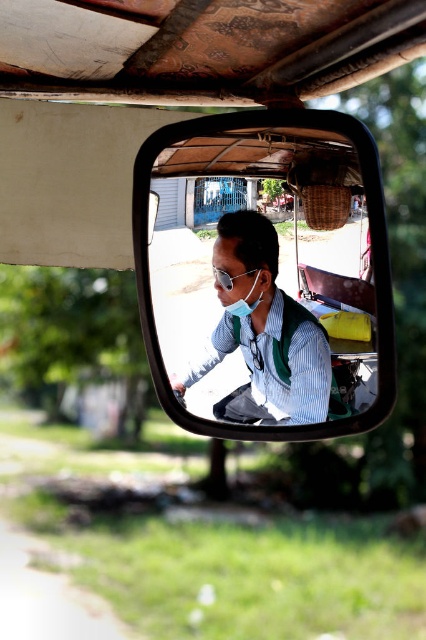
Question: Is clear plastic mirror at center closer to camera compared to matte black shirt at center?

Choices:
 (A) yes
 (B) no

Answer: (A)

Question: Which object appears farthest from the camera in this image?

Choices:
 (A) clear plastic mirror at center
 (B) matte black shirt at center
 (C) sunglasses at center

Answer: (C)

Question: Which object appears farthest from the camera in this image?

Choices:
 (A) matte black shirt at center
 (B) clear plastic mirror at center
 (C) sunglasses at center

Answer: (C)

Question: Which is farther from the sunglasses at center?

Choices:
 (A) matte black shirt at center
 (B) clear plastic mirror at center

Answer: (B)

Question: Is clear plastic mirror at center wider than sunglasses at center?

Choices:
 (A) no
 (B) yes

Answer: (B)

Question: Is matte black shirt at center positioned before green fabric mask at center?

Choices:
 (A) yes
 (B) no

Answer: (A)